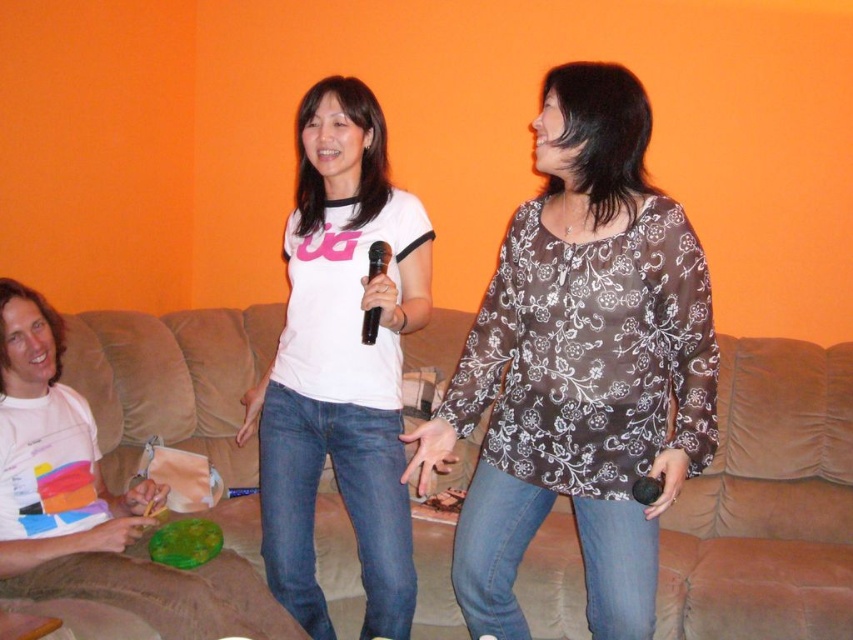
Question: Based on their relative distances, which object is nearer to the brown sheer blouse at center?

Choices:
 (A) brown fabric couch at center
 (B) white matte t-shirt at center

Answer: (B)

Question: Which of the following is the closest to the observer?

Choices:
 (A) black plastic microphone at center
 (B) brown fabric couch at center
 (C) white matte t-shirt at center

Answer: (A)

Question: Is brown fabric couch at center closer to the viewer compared to white matte t-shirt at center?

Choices:
 (A) no
 (B) yes

Answer: (A)

Question: Which of the following is the closest to the observer?

Choices:
 (A) (340, 205)
 (B) (814, 426)
 (C) (547, 102)
 (D) (372, 272)

Answer: (C)

Question: Is brown fabric couch at center above black plastic microphone at center?

Choices:
 (A) yes
 (B) no

Answer: (B)

Question: Is brown sheer blouse at center smaller than brown fabric couch at center?

Choices:
 (A) yes
 (B) no

Answer: (A)